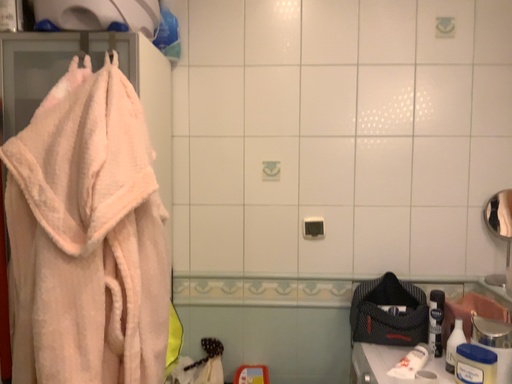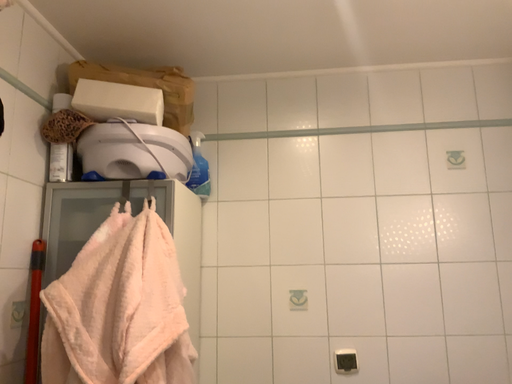
Question: Which way did the camera rotate in the video?

Choices:
 (A) rotated downward
 (B) rotated upward

Answer: (B)